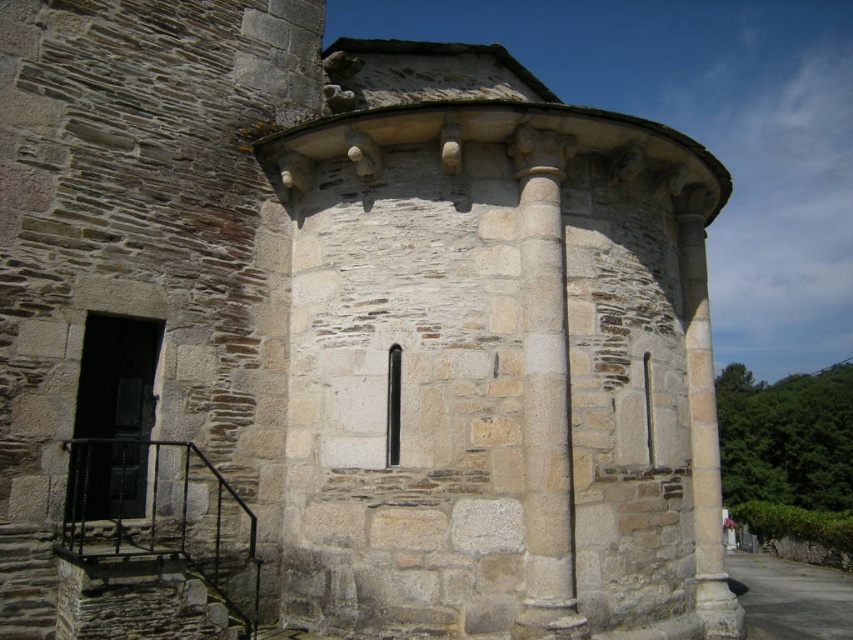
Question: Among these points, which one is nearest to the camera?

Choices:
 (A) (119, 637)
 (B) (521, 205)

Answer: (A)

Question: Considering the relative positions of smooth stone column at center and rustic stone staircase at lower left in the image provided, where is smooth stone column at center located with respect to rustic stone staircase at lower left?

Choices:
 (A) left
 (B) right

Answer: (B)

Question: Does smooth stone column at center have a smaller size compared to rustic stone staircase at lower left?

Choices:
 (A) no
 (B) yes

Answer: (A)

Question: Which of the following is the closest to the observer?

Choices:
 (A) smooth stone column at center
 (B) rustic stone staircase at lower left

Answer: (B)

Question: Does smooth stone column at center appear on the left side of rustic stone staircase at lower left?

Choices:
 (A) no
 (B) yes

Answer: (A)